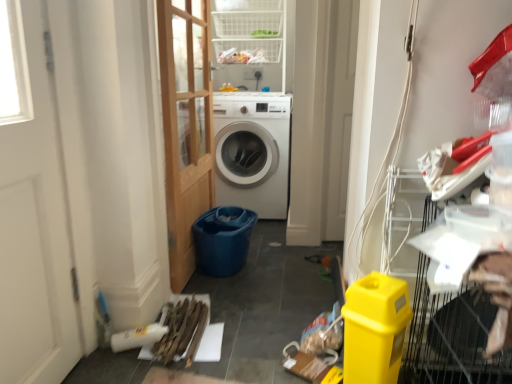
The width and height of the screenshot is (512, 384). What do you see at coordinates (35, 216) in the screenshot?
I see `white wood screen door at left` at bounding box center [35, 216].

What do you see at coordinates (249, 28) in the screenshot? The height and width of the screenshot is (384, 512). I see `white plastic shelf at upper center` at bounding box center [249, 28].

What is the approximate width of blue plastic bucket at center?

It is 30.76 centimeters.

This screenshot has width=512, height=384. Describe the element at coordinates (186, 125) in the screenshot. I see `wooden door at center` at that location.

Identify the location of yellow plastic bin at lower right. This screenshot has width=512, height=384. (375, 328).

Does yellow plastic bin at lower right have a smaller size compared to white wood screen door at left?

Yes, yellow plastic bin at lower right is smaller than white wood screen door at left.

Are yellow plastic bin at lower right and white wood screen door at left located far from each other?

They are positioned close to each other.

Could you tell me if yellow plastic bin at lower right is facing white wood screen door at left?

No, yellow plastic bin at lower right does not turn towards white wood screen door at left.

Is yellow plastic bin at lower right to the left of white wood screen door at left from the viewer's perspective?

No.

From a real-world perspective, is white glossy washing machine at center physically below white plastic shelf at upper center?

Yes, from a real-world perspective, white glossy washing machine at center is below white plastic shelf at upper center.

Between white glossy washing machine at center and white plastic shelf at upper center, which one has smaller size?

Smaller between the two is white plastic shelf at upper center.

Between point (222, 106) and point (254, 21), which one is positioned behind?

The point (254, 21) is behind.

Can you confirm if white glossy washing machine at center is thinner than white plastic shelf at upper center?

No, white glossy washing machine at center is not thinner than white plastic shelf at upper center.

Is point (253, 28) farther from camera compared to point (268, 149)?

That is False.

Are white plastic shelf at upper center and white glossy washing machine at center making contact?

No, white plastic shelf at upper center is not with white glossy washing machine at center.

Relative to white glossy washing machine at center, is white plastic shelf at upper center in front or behind?

In the image, white plastic shelf at upper center appears in front of white glossy washing machine at center.

Is white plastic shelf at upper center taller or shorter than white glossy washing machine at center?

Clearly, white plastic shelf at upper center is shorter compared to white glossy washing machine at center.

From the picture: Is white glossy washing machine at center closer to the viewer compared to wooden door at center?

No, white glossy washing machine at center is behind wooden door at center.

Is white glossy washing machine at center oriented away from wooden door at center?

No.

Based on their positions, is white glossy washing machine at center located to the left or right of wooden door at center?

From the image, it's evident that white glossy washing machine at center is to the right of wooden door at center.

How many degrees apart are the facing directions of white glossy washing machine at center and wooden door at center?

white glossy washing machine at center and wooden door at center are facing 89 degrees away from each other.

Considering the relative positions of wooden door at center and blue plastic bucket at center in the image provided, is wooden door at center behind blue plastic bucket at center?

No, wooden door at center is in front of blue plastic bucket at center.

Who is shorter, wooden door at center or blue plastic bucket at center?

With less height is blue plastic bucket at center.

From the image's perspective, which is below, wooden door at center or blue plastic bucket at center?

blue plastic bucket at center.

The height and width of the screenshot is (384, 512). I want to click on door above the blue plastic bucket at center (from the image's perspective), so click(186, 125).

What are the coordinates of `washing machine to the right of white wood screen door at left` in the screenshot? It's located at (252, 151).

Would you say white glossy washing machine at center is outside white wood screen door at left?

Yes, white glossy washing machine at center is located beyond the bounds of white wood screen door at left.

Does point (251, 157) come in front of point (17, 74)?

No, (251, 157) is further to viewer.

From the image's perspective, which one is positioned lower, white glossy washing machine at center or white wood screen door at left?

white wood screen door at left, from the image's perspective.

Can you confirm if white wood screen door at left is bigger than yellow plastic bin at lower right?

Answer: Correct, white wood screen door at left is larger in size than yellow plastic bin at lower right.

Is there a large distance between white wood screen door at left and yellow plastic bin at lower right?

No, white wood screen door at left is in close proximity to yellow plastic bin at lower right.

From the image's perspective, which is below, white wood screen door at left or yellow plastic bin at lower right?

yellow plastic bin at lower right appears lower in the image.

Is white wood screen door at left situated inside yellow plastic bin at lower right or outside?

white wood screen door at left is outside yellow plastic bin at lower right.

Locate an element on the screen. The image size is (512, 384). appliance on the right of white wood screen door at left is located at coordinates (375, 328).

Find the location of a particular element. The width and height of the screenshot is (512, 384). shelf that appears above the white glossy washing machine at center (from a real-world perspective) is located at coordinates (249, 28).

Which object lies further to the anchor point blue plastic bucket at center, white glossy washing machine at center or white wood screen door at left?

Based on the image, white wood screen door at left appears to be further to blue plastic bucket at center.

From the image, which object appears to be nearer to white glossy washing machine at center, wooden door at center or blue plastic bucket at center?

wooden door at center is positioned closer to the anchor white glossy washing machine at center.

Based on the photo, considering their positions, is white plastic shelf at upper center positioned further to blue plastic bucket at center than wooden door at center?

The object further to blue plastic bucket at center is white plastic shelf at upper center.

Based on their spatial positions, is yellow plastic bin at lower right or wooden planks at lower left closer to blue plastic bucket at center?

Based on the image, wooden planks at lower left appears to be nearer to blue plastic bucket at center.

Estimate the real-world distances between objects in this image. Which object is further from wooden door at center, wooden planks at lower left or white plastic shelf at upper center?

Among the two, white plastic shelf at upper center is located further to wooden door at center.

Estimate the real-world distances between objects in this image. Which object is closer to blue plastic bucket at center, white wood screen door at left or wooden planks at lower left?

wooden planks at lower left is closer to blue plastic bucket at center.

When comparing their distances from blue plastic bucket at center, does wooden planks at lower left or white plastic shelf at upper center seem closer?

Among the two, wooden planks at lower left is located nearer to blue plastic bucket at center.

Looking at the image, which one is located further to white plastic shelf at upper center, wooden planks at lower left or wooden door at center?

wooden planks at lower left is further to white plastic shelf at upper center.

I want to click on door between yellow plastic bin at lower right and white glossy washing machine at center along the z-axis, so click(186, 125).

Locate an element on the screen. This screenshot has height=384, width=512. shelf located between wooden door at center and white glossy washing machine at center in the depth direction is located at coordinates (249, 28).

Identify the location of door located between yellow plastic bin at lower right and blue plastic bucket at center in the depth direction. (186, 125).

Where is `door between wooden planks at lower left and white glossy washing machine at center along the z-axis`? This screenshot has width=512, height=384. door between wooden planks at lower left and white glossy washing machine at center along the z-axis is located at coordinates (186, 125).